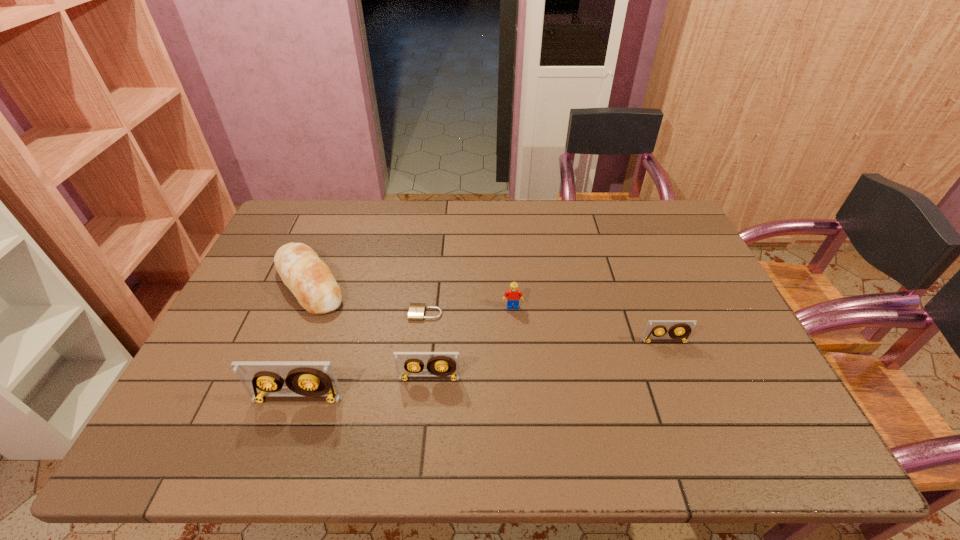
If the aim is uniform spacing by inserting an additional videotape among them, please point to a vacant space for this new videotape. Please provide its 2D coordinates. Your answer should be formatted as a tuple, i.e. [(x, y)], where the tuple contains the x and y coordinates of a point satisfying the conditions above.

[(551, 359)]